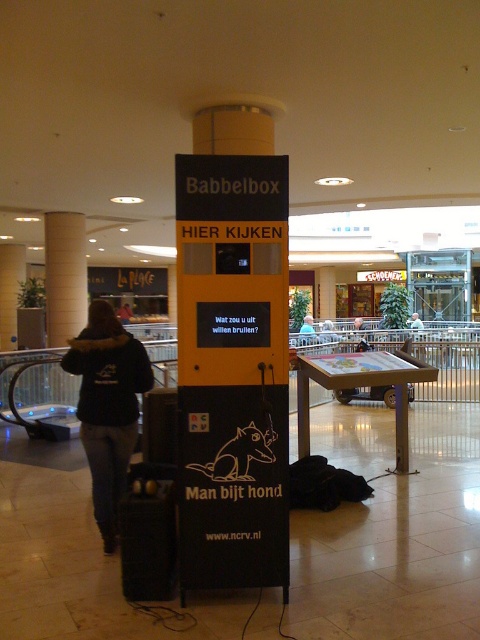
How distant is white glossy pillar at upper left from blue denim jacket at center?

white glossy pillar at upper left is 20.95 feet from blue denim jacket at center.

Is white glossy pillar at upper left taller than blue denim jacket at center?

Correct, white glossy pillar at upper left is much taller as blue denim jacket at center.

Is point (55, 269) less distant than point (312, 339)?

Yes, point (55, 269) is closer to viewer.

Locate an element on the screen. Image resolution: width=480 pixels, height=640 pixels. white glossy pillar at upper left is located at coordinates (64, 275).

Is yellow matte babbelbox at center bigger than black fleece jacket at left?

Indeed, yellow matte babbelbox at center has a larger size compared to black fleece jacket at left.

Which is in front, point (280, 202) or point (79, 410)?

Point (280, 202) is more forward.

Is point (279, 544) less distant than point (103, 444)?

Yes, it is.

At what (x,y) coordinates should I click in order to perform the action: click on yellow matte babbelbox at center. Please return your answer as a coordinate pair (x, y). This screenshot has width=480, height=640. Looking at the image, I should click on (232, 353).

Can you confirm if black fleece jacket at left is taller than white glossy pillar at upper left?

Incorrect, black fleece jacket at left's height is not larger of white glossy pillar at upper left's.

Who is higher up, black fleece jacket at left or white glossy pillar at upper left?

white glossy pillar at upper left is higher up.

Locate an element on the screen. The height and width of the screenshot is (640, 480). black fleece jacket at left is located at coordinates (108, 406).